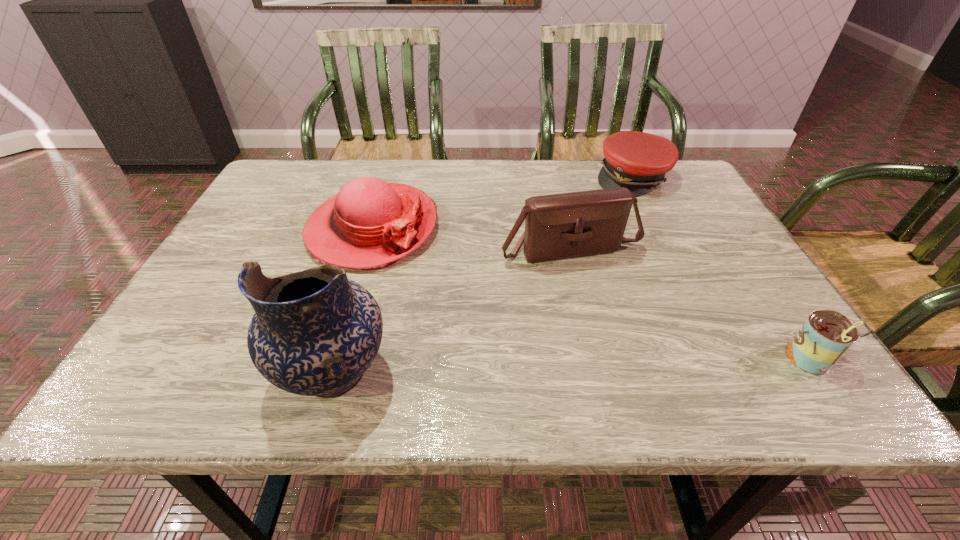
Identify the location of free space on the desktop that is between the pottery and the can and is positioned at the front of the hat with a bow. (504, 368).

Identify the location of vacant space on the desktop that is between the tallest object and the can and is positioned on the front flap of the second tallest object. Image resolution: width=960 pixels, height=540 pixels. (637, 364).

The width and height of the screenshot is (960, 540). I want to click on free space on the desktop that is between the pottery and the can and is positioned on the front of the shortest object with an emblem, so click(561, 367).